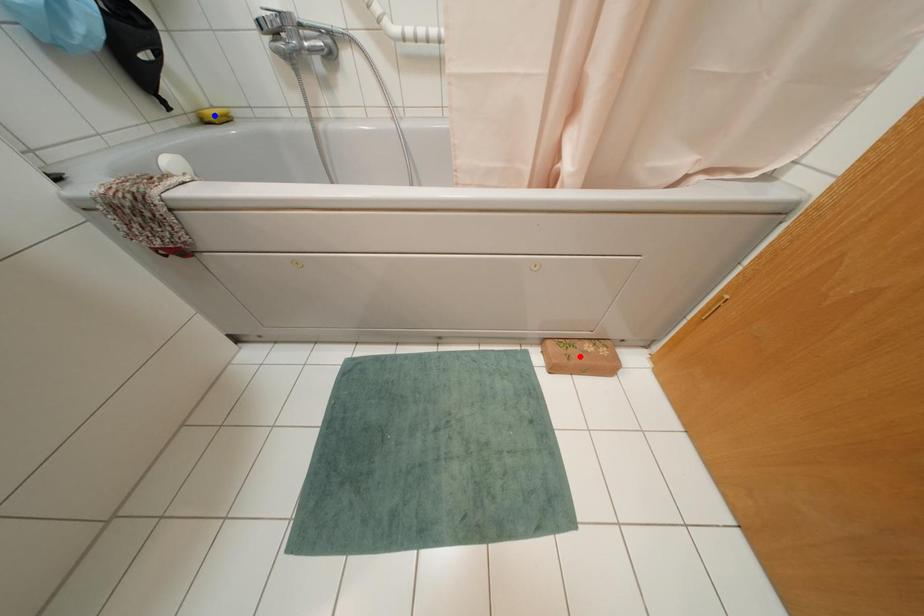
Question: In the image, two points are highlighted. Which point is nearer to the camera? Reply with the corresponding letter.

Choices:
 (A) blue point
 (B) red point

Answer: (B)